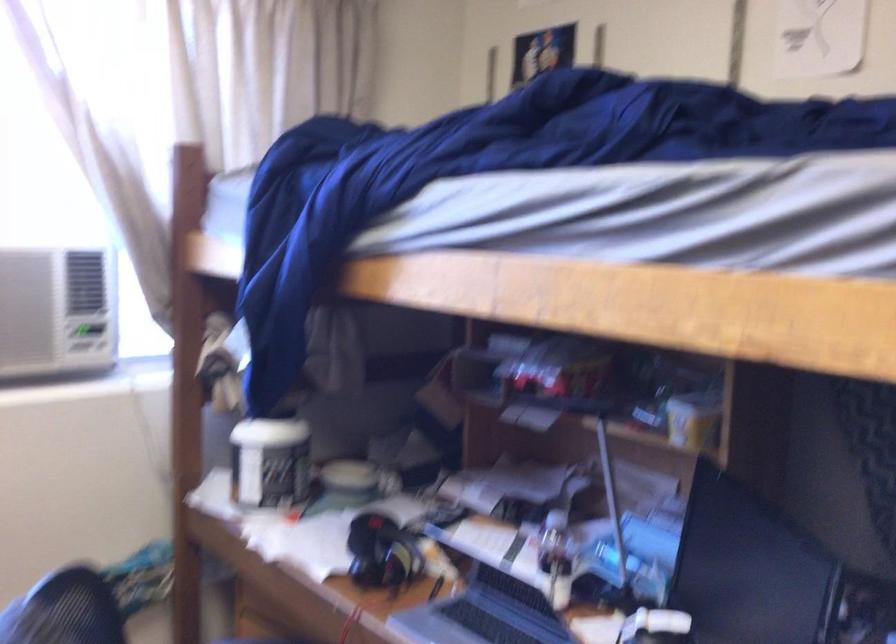
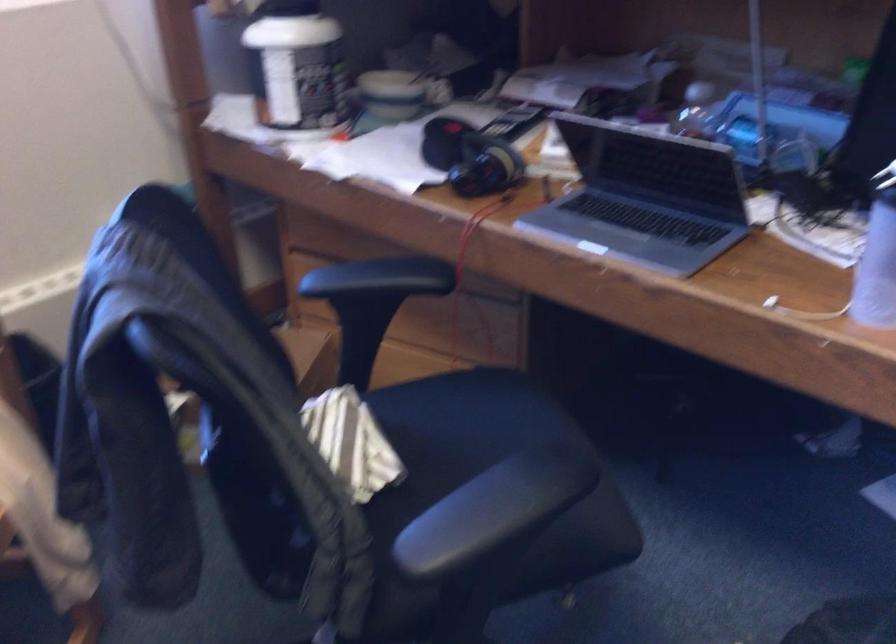
In the second image, find the point that corresponds to point 268,460 in the first image.

(297, 67)